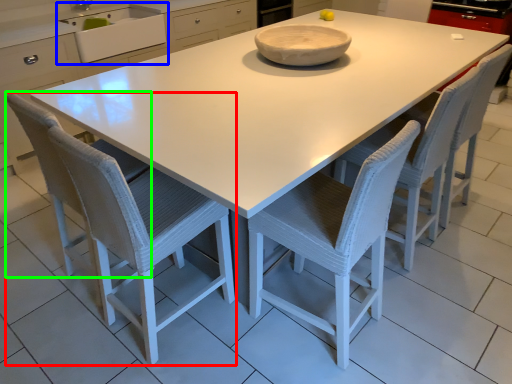
Question: Estimate the real-world distances between objects in this image. Which object is closer to chair (highlighted by a red box), sink (highlighted by a blue box) or swivel chair (highlighted by a green box)?

Choices:
 (A) sink
 (B) swivel chair

Answer: (B)